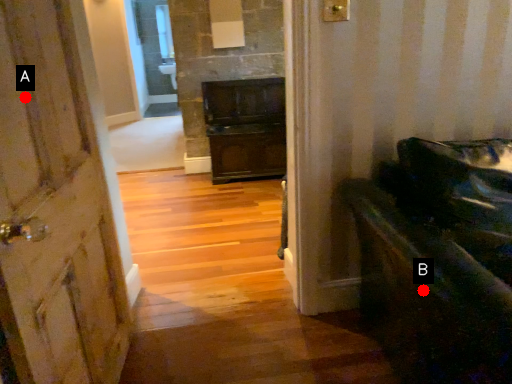
Question: Two points are circled on the image, labeled by A and B beside each circle. Which point is farther to the camera?

Choices:
 (A) A is further
 (B) B is further

Answer: (B)